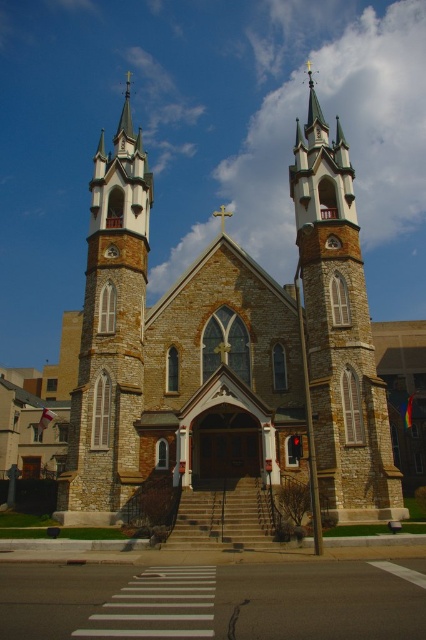
You are a photographer planning to capture the church from the crosswalk. You notice two stone steeples in your viewfinder. Which steeple, the stone steeple at center or the stone steeple at left, appears narrower in your photo?

The stone steeple at center appears narrower because it has a lesser width compared to the stone steeple at left.

You are a tourist standing on the pedestrian crosswalk in front of the church. You want to take a photo that includes both the stone church at center and the stone steeple at center. In which direction should you move to ensure both are visible in your camera frame?

The stone church at center is to the left of stone steeple at center, so you should position yourself so that both objects are aligned horizontally within your camera frame, with the stone church at center on the left and the stone steeple at center on the right.

You are a tourist standing at the crosswalk in front of the church. You see the stone church at center and the stone steeple at left. Which one is positioned more to the east if the crosswalk is facing north?

The stone steeple at left is positioned more to the east because the stone church at center is to the right of the stone steeple at left, and since the crosswalk faces north, right would be east.